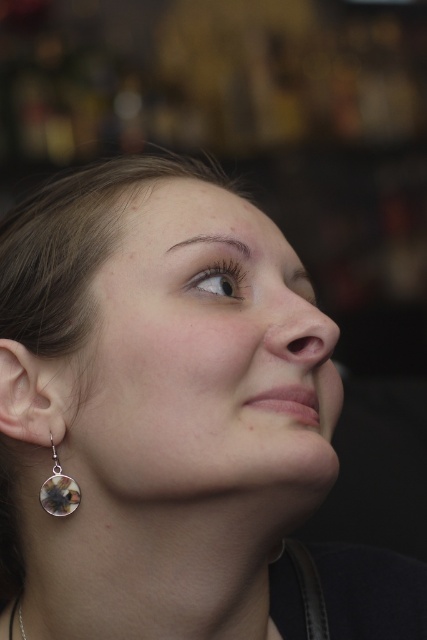
You are a photographer adjusting the lighting for a portrait. You notice the brown matte eye at upper right and the multicolored glass earring at lower left. Which object is located more to the right in the image?

The brown matte eye at upper right is positioned on the right side of multicolored glass earring at lower left, so it is more to the right.

You are a photographer adjusting the camera settings. The subject has a point at coordinates point (198, 273). If the camera sensor can only capture objects within 18 inches, will the subject be fully captured?

The point at coordinates point (198, 273) is 18.13 inches away from the camera. Since the camera sensor can only capture objects within 18 inches, the subject will not be fully captured.

You are a photographer analyzing the composition of this portrait. You notice the brown matte eye at upper right and the multicolored glass earring at lower left. Which object is bigger in the image?

The brown matte eye at upper right has a larger size compared to the multicolored glass earring at lower left, so the brown matte eye at upper right is bigger.